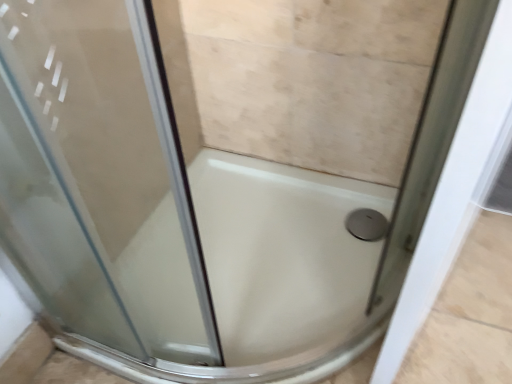
Question: Is satin silver drain at bottom right positioned in front of white glossy bath at center?

Choices:
 (A) no
 (B) yes

Answer: (A)

Question: Is satin silver drain at bottom right thinner than white glossy bath at center?

Choices:
 (A) no
 (B) yes

Answer: (B)

Question: Is satin silver drain at bottom right positioned behind white glossy bath at center?

Choices:
 (A) yes
 (B) no

Answer: (A)

Question: From a real-world perspective, is satin silver drain at bottom right beneath white glossy bath at center?

Choices:
 (A) no
 (B) yes

Answer: (B)

Question: Could white glossy bath at center be considered to be inside satin silver drain at bottom right?

Choices:
 (A) yes
 (B) no

Answer: (B)

Question: From the image's perspective, is satin silver drain at bottom right located beneath white glossy bath at center?

Choices:
 (A) no
 (B) yes

Answer: (A)

Question: Does white glossy bath at center come behind satin silver drain at bottom right?

Choices:
 (A) yes
 (B) no

Answer: (B)

Question: From the image's perspective, is white glossy bath at center over satin silver drain at bottom right?

Choices:
 (A) yes
 (B) no

Answer: (B)

Question: Considering the relative positions of white glossy bath at center and satin silver drain at bottom right in the image provided, is white glossy bath at center in front of satin silver drain at bottom right?

Choices:
 (A) no
 (B) yes

Answer: (B)

Question: Can you confirm if white glossy bath at center is positioned to the right of satin silver drain at bottom right?

Choices:
 (A) no
 (B) yes

Answer: (A)

Question: Is satin silver drain at bottom right a part of white glossy bath at center?

Choices:
 (A) yes
 (B) no

Answer: (A)

Question: Is white glossy bath at center not near satin silver drain at bottom right?

Choices:
 (A) no
 (B) yes

Answer: (A)

Question: Considering the positions of point (375, 196) and point (350, 213), is point (375, 196) closer or farther from the camera than point (350, 213)?

Choices:
 (A) closer
 (B) farther

Answer: (A)